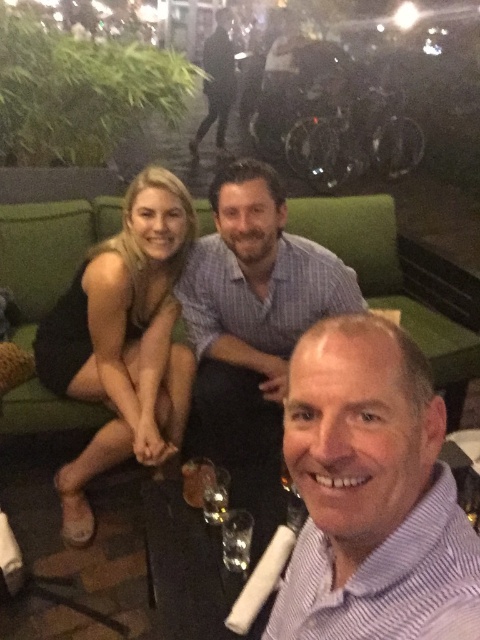
You are helping to arrange a small event and need to place a 20cm wide decorative pillow on either the striped cotton shirt at center or the green fabric couch at center. Based on their widths, which object can the pillow fit on without overhanging?

The striped cotton shirt at center is thinner than the green fabric couch at center, so the pillow can fit on the green fabric couch at center without overhanging since it is wider.

You are at a social gathering and want to take a photo of two specific points in the scene. The first point is at coordinates point (64,413) and the second is at point (223,561). From your current position, which point would you need to move towards to capture both in the frame without changing your angle?

Point (64,413) is behind point (223,561), so you should move towards point (223,561) to ensure both points are visible in the frame.